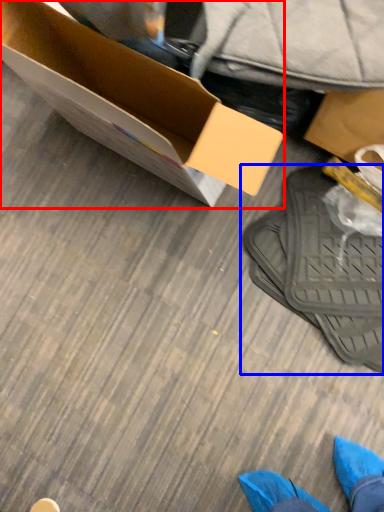
Question: Which object appears farthest to the camera in this image, box (highlighted by a red box) or footwear (highlighted by a blue box)?

Choices:
 (A) box
 (B) footwear

Answer: (B)